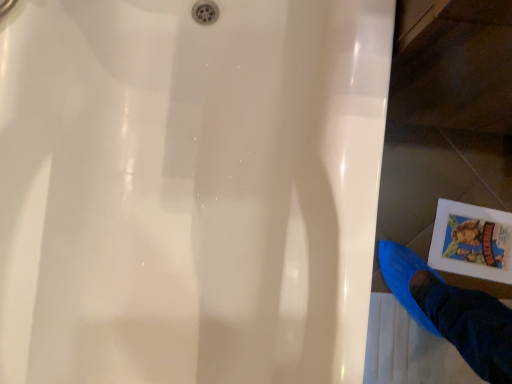
You are a GUI agent. You are given a task and a screenshot of the screen. Output one action in this format:
    pyautogui.click(x=<x>, y=<y>)
    Task: Click on the free space above white paper comic book at lower right (from a real-world perspective)
    The width and height of the screenshot is (512, 384).
    Given the screenshot: What is the action you would take?
    pyautogui.click(x=477, y=243)